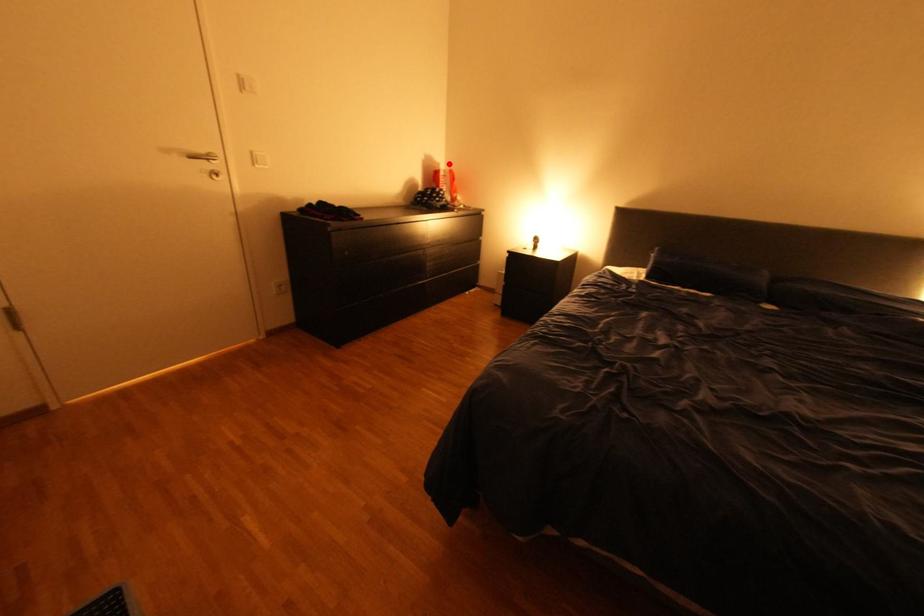
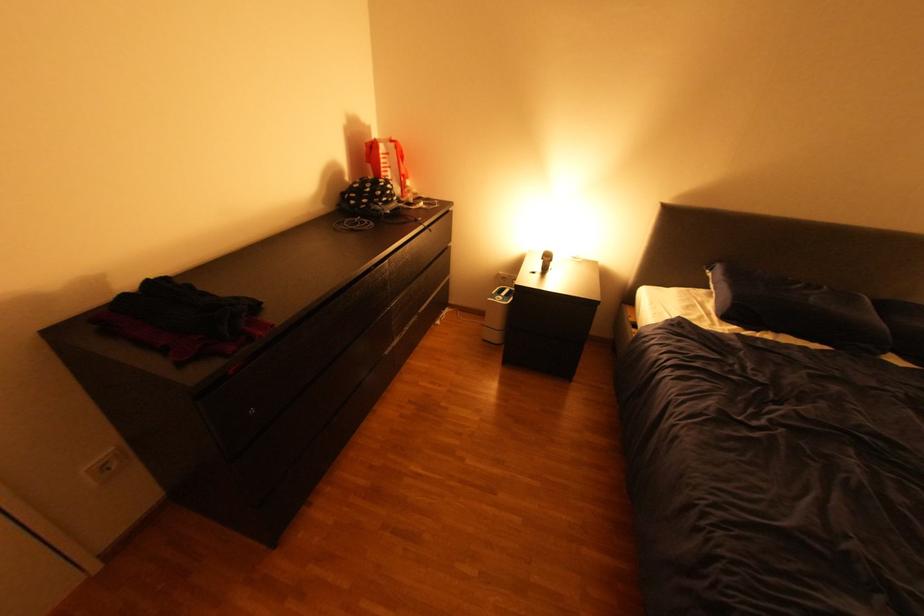
Question: I am providing you with two images of the same scene from different viewpoints. In image1, a red point is highlighted. Considering the same 3D point in image2, which of the following is correct?

Choices:
 (A) It is closer
 (B) It is farther

Answer: (B)